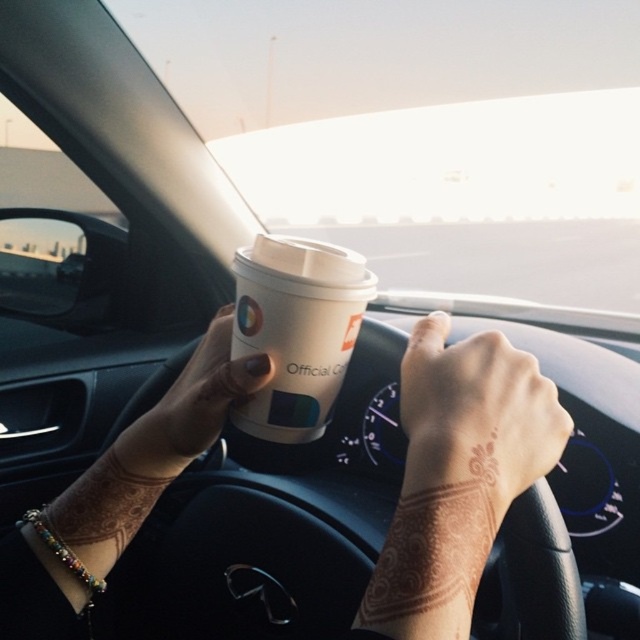
You are a passenger in the car and need to reach the white paper cup at upper center to take a sip. Considering the driver is holding it, where should you ask them to move it?

The white paper cup at upper center is located at point (458, 476), so you should ask the driver to move it to a more accessible location like the cup holder or passenger seat.

You are a passenger in the car and want to grab the white paper cup at upper center. Based on the coordinates provided, can you estimate its position relative to the steering wheel?

The white paper cup at upper center is located at coordinates point (458, 476). Since the steering wheel is at the center of the car dashboard, the cup is positioned to the right and slightly above the steering wheel.

Based on the photo, you are a passenger in the car and want to point out the brown henna tattoo at center to someone outside the car. Can you describe its exact location using coordinates?

The brown henna tattoo at center is located at coordinates point [476,412].